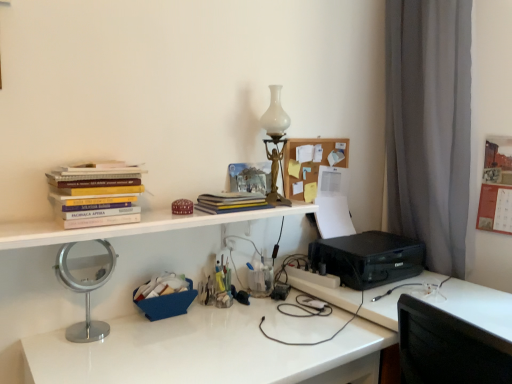
Locate an element on the screen. The image size is (512, 384). free space to the right of blue fabric basket at center, arranged as the 1th stationery when ordered from the bottom is located at coordinates (216, 323).